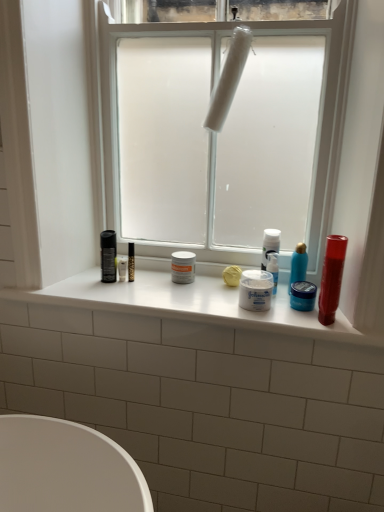
Locate an element on the screen. The height and width of the screenshot is (512, 384). vacant space in front of blue glossy bottle at center right, which ranks as the fourth toiletry in left-to-right order is located at coordinates (305, 318).